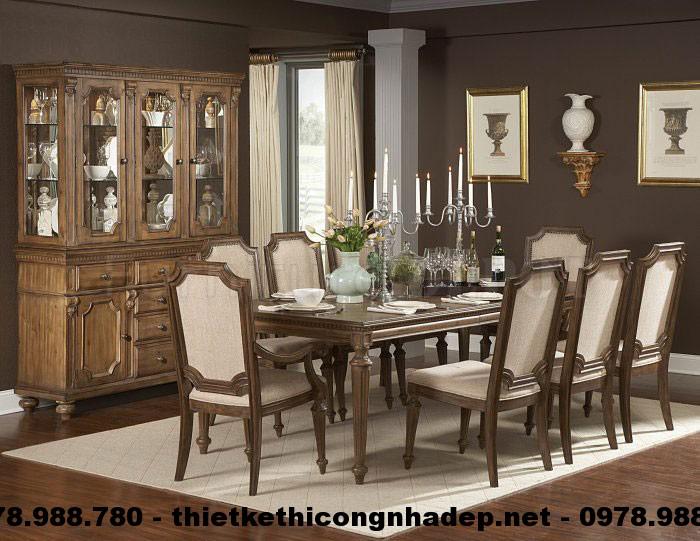
Where is `chairs`? chairs is located at coordinates (524, 315), (600, 304), (645, 299), (538, 241), (365, 249), (300, 262), (248, 270), (222, 325).